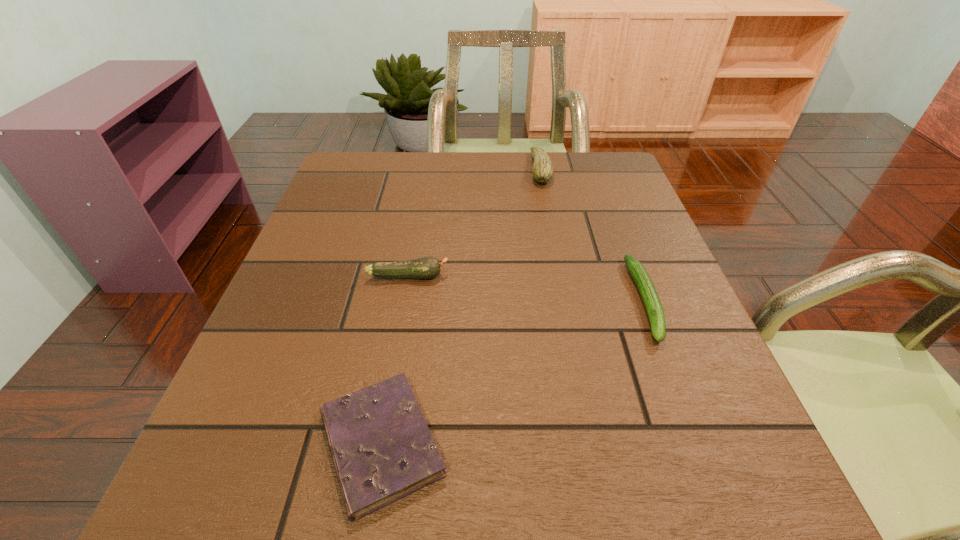
Image resolution: width=960 pixels, height=540 pixels. In order to click on vacant area in the image that satisfies the following two spatial constraints: 1. at the blossom end of the diary; 2. on the left side of the second tallest zucchini in this screenshot , I will do `click(378, 444)`.

Where is `free space that satisfies the following two spatial constraints: 1. at the blossom end of the diary; 2. on the right side of the third shortest object`? The image size is (960, 540). free space that satisfies the following two spatial constraints: 1. at the blossom end of the diary; 2. on the right side of the third shortest object is located at coordinates (378, 444).